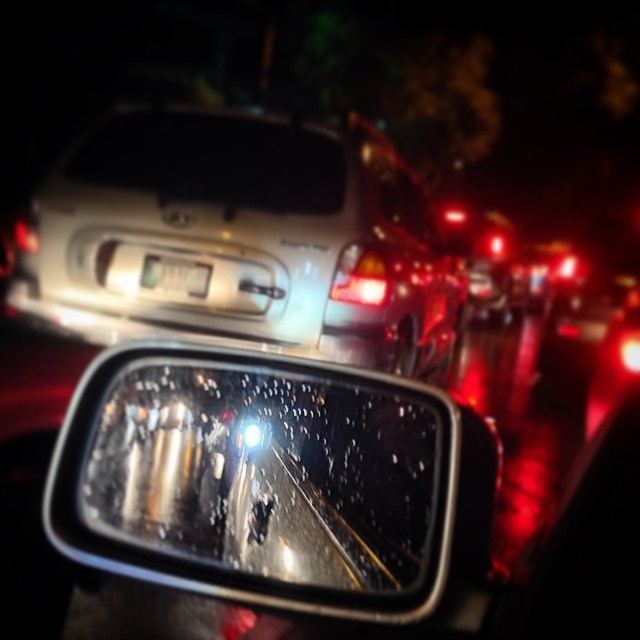
Between transparent glass at upper center and white plastic license plate at center, which one has less height?

white plastic license plate at center is shorter.

The image size is (640, 640). Describe the element at coordinates (212, 161) in the screenshot. I see `transparent glass at upper center` at that location.

Which is behind, point (177, 200) or point (168, 275)?

The point (168, 275) is behind.

This screenshot has height=640, width=640. Find the location of `transparent glass at upper center`. transparent glass at upper center is located at coordinates (212, 161).

In the scene shown: Does satin silver sedan at upper center appear on the left side of transparent glass at upper center?

No, satin silver sedan at upper center is not to the left of transparent glass at upper center.

Is satin silver sedan at upper center positioned in front of transparent glass at upper center?

Yes, satin silver sedan at upper center is closer to the viewer.

Is point (246, 243) positioned after point (262, 172)?

That is True.

This screenshot has height=640, width=640. In order to click on satin silver sedan at upper center in this screenshot , I will do `click(237, 234)`.

Is point (212, 486) more distant than point (372, 259)?

No, (212, 486) is in front of (372, 259).

Does clear glass mirror at center have a greater width compared to matte plastic headlight at upper center?

Indeed, clear glass mirror at center has a greater width compared to matte plastic headlight at upper center.

Which is behind, point (444, 564) or point (342, 252)?

The point (342, 252) is more distant.

Identify the location of clear glass mirror at center. (259, 480).